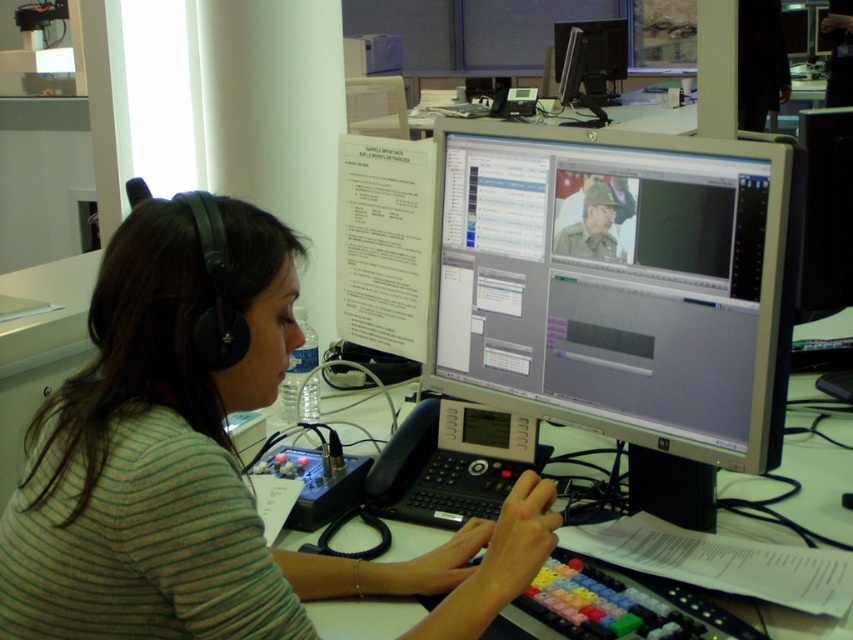
You are a technician troubleshooting a workspace setup. You notice two monitors on the desk. Which monitor is located to the left of the other? The options are the matte gray monitor at center and the matte black monitor at upper center.

The matte gray monitor at center is positioned on the left side of the matte black monitor at upper center, so the matte gray monitor at center is to the left of the matte black monitor at upper center.

You are a technician who needs to access the matte gray monitor at center without disturbing the person wearing the green striped shirt at center. Is there enough space to reach the monitor?

The green striped shirt at center is in front of the matte gray monitor at center, so reaching the monitor might be difficult as the person is blocking access.

Where is the matte gray monitor at center located in the coordinate system?

The matte gray monitor at center is located at point coordinates of (618, 284).